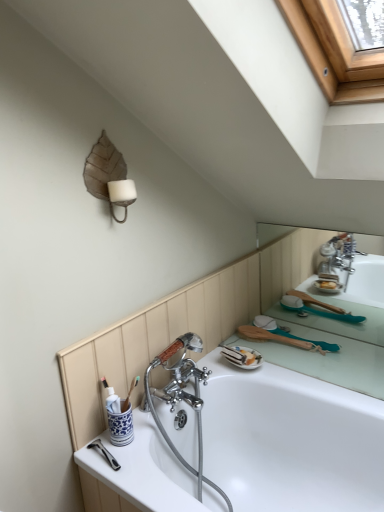
Question: Does white glossy bathtub at center have a larger size compared to burlap leaf at upper left?

Choices:
 (A) yes
 (B) no

Answer: (A)

Question: Is white glossy bathtub at center positioned with its back to burlap leaf at upper left?

Choices:
 (A) no
 (B) yes

Answer: (A)

Question: Is white glossy bathtub at center to the right of burlap leaf at upper left from the viewer's perspective?

Choices:
 (A) no
 (B) yes

Answer: (B)

Question: Is white glossy bathtub at center thinner than burlap leaf at upper left?

Choices:
 (A) no
 (B) yes

Answer: (A)

Question: From a real-world perspective, is white glossy bathtub at center located beneath burlap leaf at upper left?

Choices:
 (A) no
 (B) yes

Answer: (B)

Question: Would you say white glossy bathtub at center is a long distance from burlap leaf at upper left?

Choices:
 (A) no
 (B) yes

Answer: (A)

Question: From the image's perspective, is burlap leaf at upper left over white glossy bathtub at center?

Choices:
 (A) no
 (B) yes

Answer: (B)

Question: Can you confirm if burlap leaf at upper left is wider than white glossy bathtub at center?

Choices:
 (A) no
 (B) yes

Answer: (A)

Question: Considering the relative positions of burlap leaf at upper left and white glossy bathtub at center in the image provided, is burlap leaf at upper left to the right of white glossy bathtub at center from the viewer's perspective?

Choices:
 (A) no
 (B) yes

Answer: (A)

Question: Can you confirm if burlap leaf at upper left is positioned to the left of white glossy bathtub at center?

Choices:
 (A) yes
 (B) no

Answer: (A)

Question: Is burlap leaf at upper left positioned beyond the bounds of white glossy bathtub at center?

Choices:
 (A) yes
 (B) no

Answer: (A)

Question: From a real-world perspective, is burlap leaf at upper left on top of white glossy bathtub at center?

Choices:
 (A) no
 (B) yes

Answer: (B)

Question: Is burlap leaf at upper left taller or shorter than white glossy bathtub at center?

Choices:
 (A) short
 (B) tall

Answer: (A)